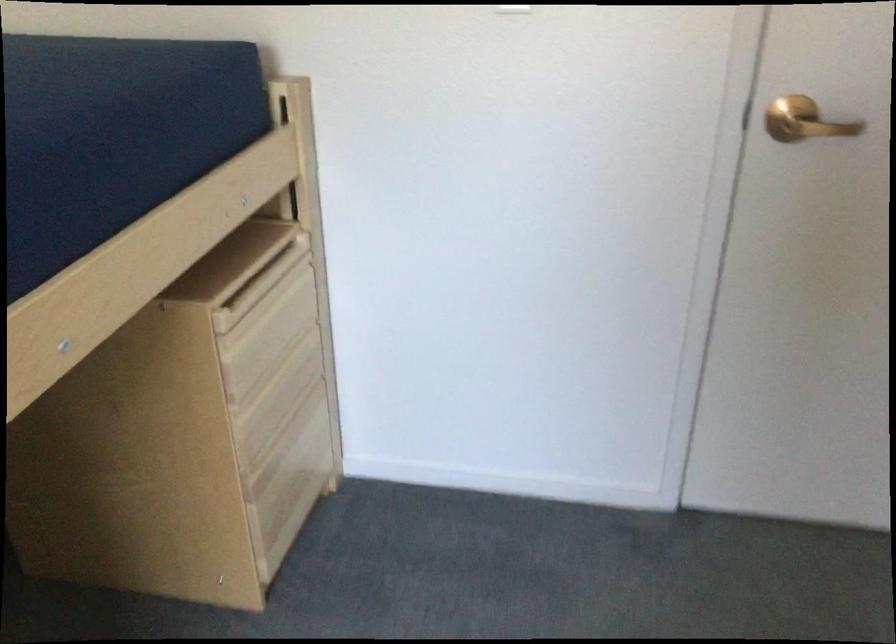
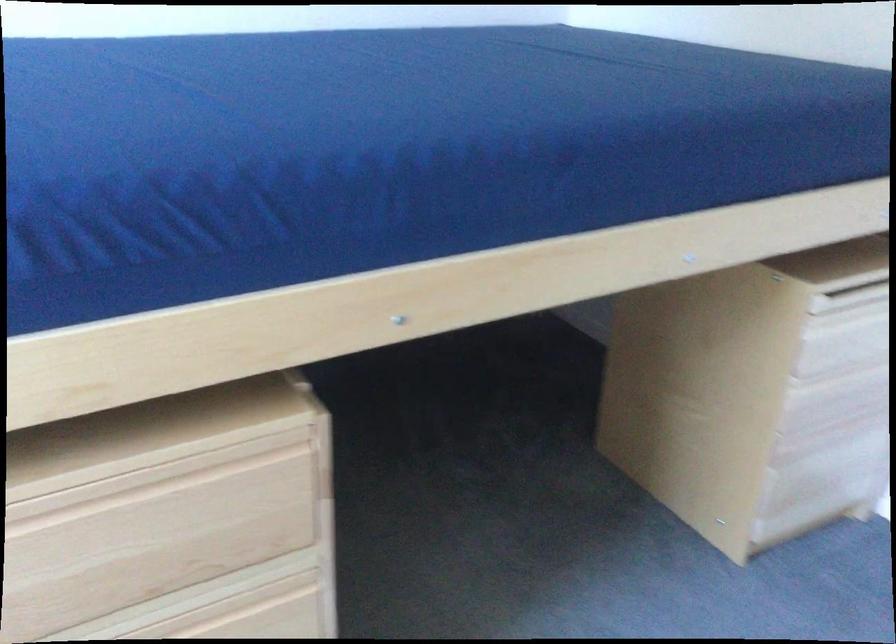
In the second image, find the point that corresponds to [281,375] in the first image.

(845, 381)